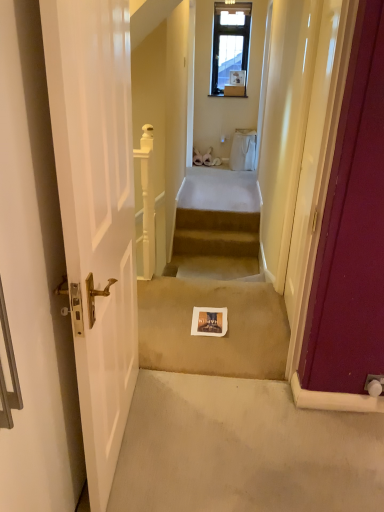
Question: Can you confirm if matte burgundy door at right, which is the first door in right-to-left order, is taller than white paper at center?

Choices:
 (A) yes
 (B) no

Answer: (A)

Question: Can you confirm if matte burgundy door at right, which is the first door in right-to-left order, is thinner than white paper at center?

Choices:
 (A) yes
 (B) no

Answer: (A)

Question: From a real-world perspective, is matte burgundy door at right, which is the first door in right-to-left order, over white paper at center?

Choices:
 (A) no
 (B) yes

Answer: (B)

Question: Is matte burgundy door at right, which is the first door in right-to-left order, surrounding white paper at center?

Choices:
 (A) no
 (B) yes

Answer: (A)

Question: Is matte burgundy door at right, placed as the second door when sorted from left to right, bigger than white paper at center?

Choices:
 (A) no
 (B) yes

Answer: (B)

Question: From their relative heights in the image, would you say beige carpeted stairs at center is taller or shorter than matte burgundy door at right, placed as the second door when sorted from left to right?

Choices:
 (A) short
 (B) tall

Answer: (A)

Question: Is beige carpeted stairs at center bigger or smaller than matte burgundy door at right, which is the first door in right-to-left order?

Choices:
 (A) big
 (B) small

Answer: (B)

Question: Is beige carpeted stairs at center inside the boundaries of matte burgundy door at right, placed as the second door when sorted from left to right, or outside?

Choices:
 (A) inside
 (B) outside

Answer: (B)

Question: From the image's perspective, is beige carpeted stairs at center above or below matte burgundy door at right, which is the first door in right-to-left order?

Choices:
 (A) below
 (B) above

Answer: (A)

Question: From the image's perspective, is matte burgundy door at right, placed as the second door when sorted from left to right, positioned above or below white paper at center?

Choices:
 (A) below
 (B) above

Answer: (B)

Question: In terms of height, does matte burgundy door at right, which is the first door in right-to-left order, look taller or shorter compared to white paper at center?

Choices:
 (A) tall
 (B) short

Answer: (A)

Question: Visually, is matte burgundy door at right, which is the first door in right-to-left order, positioned to the left or to the right of white paper at center?

Choices:
 (A) right
 (B) left

Answer: (A)

Question: Considering the positions of matte burgundy door at right, which is the first door in right-to-left order, and white paper at center in the image, is matte burgundy door at right, which is the first door in right-to-left order, bigger or smaller than white paper at center?

Choices:
 (A) small
 (B) big

Answer: (B)

Question: Is point (160, 329) closer or farther from the camera than point (228, 241)?

Choices:
 (A) farther
 (B) closer

Answer: (B)

Question: From a real-world perspective, is white paper at center physically located above or below beige carpeted stairs at center?

Choices:
 (A) above
 (B) below

Answer: (A)